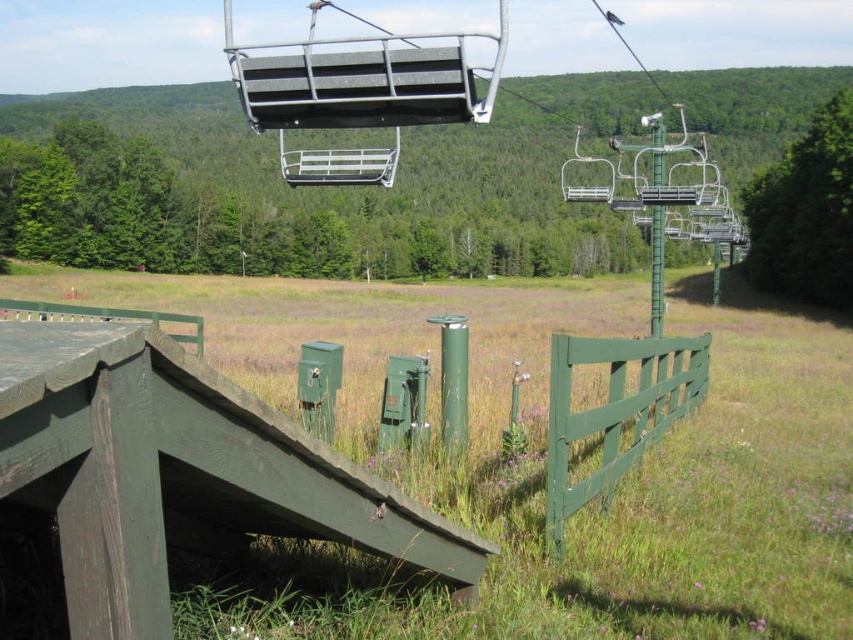
Is green wood ramp at lower center thinner than green wooden fence at lower right?

Indeed, green wood ramp at lower center has a lesser width compared to green wooden fence at lower right.

Who is more forward, (x=80, y=346) or (x=602, y=419)?

Point (x=80, y=346) is more forward.

You are a GUI agent. You are given a task and a screenshot of the screen. Output one action in this format:
    pyautogui.click(x=<x>, y=<y>)
    Task: Click on the green wood ramp at lower center
    The image size is (853, 640).
    Given the screenshot: What is the action you would take?
    pyautogui.click(x=166, y=481)